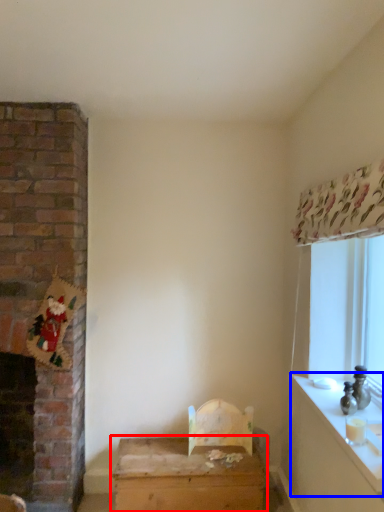
Question: Which object is further to the camera taking this photo, table (highlighted by a red box) or counter top (highlighted by a blue box)?

Choices:
 (A) table
 (B) counter top

Answer: (A)